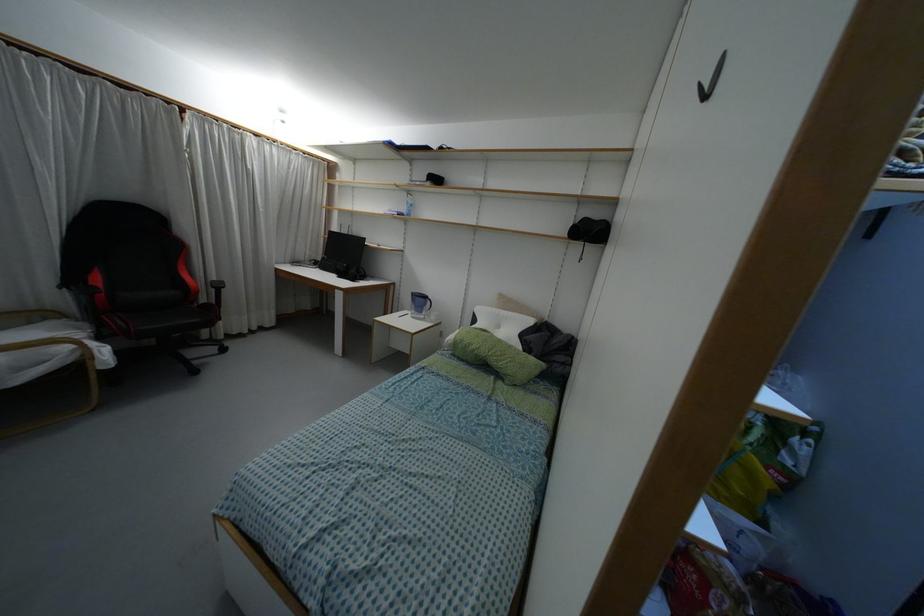
The width and height of the screenshot is (924, 616). Describe the element at coordinates (710, 83) in the screenshot. I see `the black wall hook` at that location.